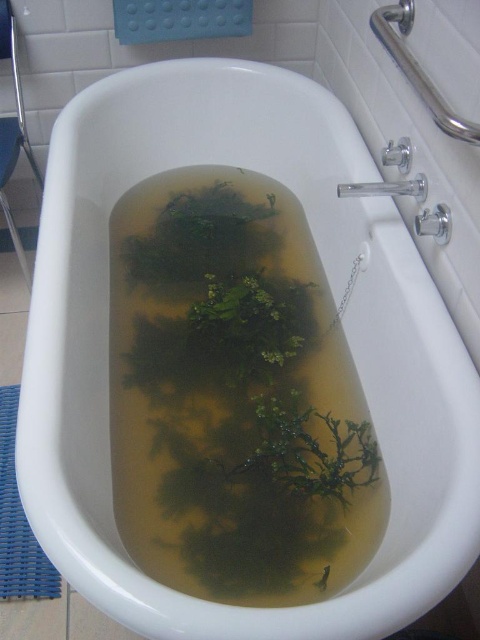
How far apart are green murky water at center and blue woven mat at lower left?

53.73 centimeters

Which is in front, point (204, 365) or point (1, 396)?

Point (204, 365) is more forward.

This screenshot has width=480, height=640. What are the coordinates of `green murky water at center` in the screenshot? It's located at (235, 396).